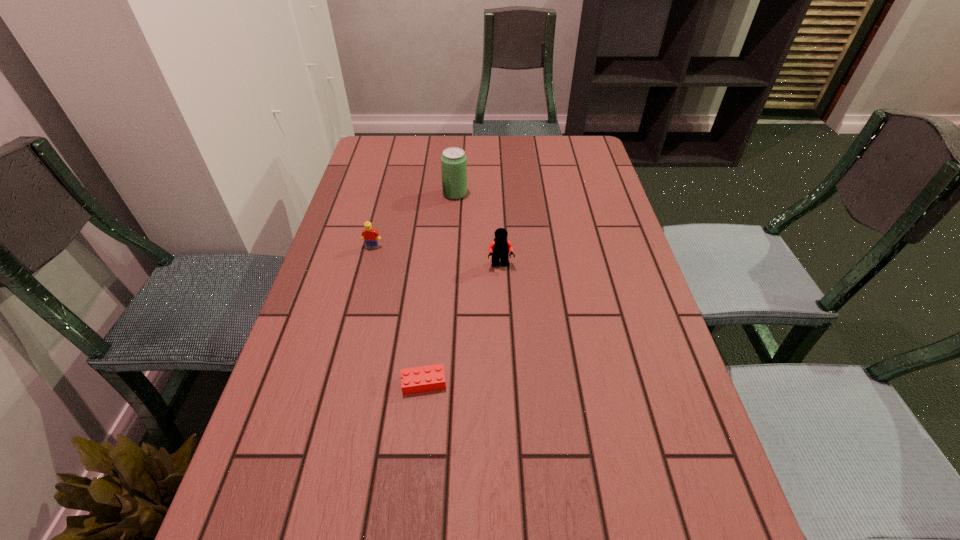
In order to click on free spot between the nearest Lego and the soda in this screenshot , I will do `click(440, 288)`.

Where is `free space between the tallest Lego and the farthest object`? free space between the tallest Lego and the farthest object is located at coordinates (478, 230).

What are the coordinates of `free area in between the tallest object and the nearest object` in the screenshot? It's located at (440, 288).

Identify the location of free spot between the second tallest object and the third tallest object. The width and height of the screenshot is (960, 540). (437, 256).

Find the location of a particular element. This screenshot has width=960, height=540. empty location between the second Lego from right to left and the rightmost object is located at coordinates (462, 324).

Locate an element on the screen. The width and height of the screenshot is (960, 540). free spot between the farthest Lego and the shortest object is located at coordinates [x=398, y=315].

Locate an element on the screen. The width and height of the screenshot is (960, 540). vacant area that lies between the nearest Lego and the farthest object is located at coordinates pos(440,288).

You are a GUI agent. You are given a task and a screenshot of the screen. Output one action in this format:
    pyautogui.click(x=<x>, y=<y>)
    Task: Click on the free point between the rightmost Lego and the second Lego from left to right
    The width and height of the screenshot is (960, 540).
    Given the screenshot: What is the action you would take?
    pyautogui.click(x=462, y=324)

Select which object is the closest to the nearest object. Please provide its 2D coordinates. Your answer should be formatted as a tuple, i.e. [(x, y)], where the tuple contains the x and y coordinates of a point satisfying the conditions above.

[(499, 249)]

Identify which object is the second nearest to the soda. Please provide its 2D coordinates. Your answer should be formatted as a tuple, i.e. [(x, y)], where the tuple contains the x and y coordinates of a point satisfying the conditions above.

[(499, 249)]